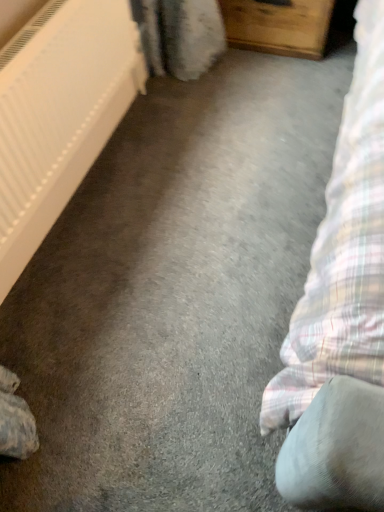
Question: Can you confirm if wooden chest of drawers at upper center is wider than white plastic radiator at left?

Choices:
 (A) yes
 (B) no

Answer: (A)

Question: Does wooden chest of drawers at upper center lie in front of white plastic radiator at left?

Choices:
 (A) no
 (B) yes

Answer: (A)

Question: Is wooden chest of drawers at upper center not within white plastic radiator at left?

Choices:
 (A) yes
 (B) no

Answer: (A)

Question: Does wooden chest of drawers at upper center contain white plastic radiator at left?

Choices:
 (A) yes
 (B) no

Answer: (B)

Question: Can you confirm if wooden chest of drawers at upper center is shorter than white plastic radiator at left?

Choices:
 (A) no
 (B) yes

Answer: (B)

Question: From a real-world perspective, does wooden chest of drawers at upper center stand above white plastic radiator at left?

Choices:
 (A) no
 (B) yes

Answer: (A)

Question: Is white plastic radiator at left to the left of wooden chest of drawers at upper center from the viewer's perspective?

Choices:
 (A) no
 (B) yes

Answer: (B)

Question: Are white plastic radiator at left and wooden chest of drawers at upper center making contact?

Choices:
 (A) no
 (B) yes

Answer: (A)

Question: Can you confirm if white plastic radiator at left is shorter than wooden chest of drawers at upper center?

Choices:
 (A) no
 (B) yes

Answer: (A)

Question: From a real-world perspective, is white plastic radiator at left physically above wooden chest of drawers at upper center?

Choices:
 (A) no
 (B) yes

Answer: (B)

Question: Can you confirm if white plastic radiator at left is wider than wooden chest of drawers at upper center?

Choices:
 (A) no
 (B) yes

Answer: (A)

Question: Does white plastic radiator at left come in front of wooden chest of drawers at upper center?

Choices:
 (A) no
 (B) yes

Answer: (B)

Question: Considering the positions of wooden chest of drawers at upper center and white plastic radiator at left in the image, is wooden chest of drawers at upper center taller or shorter than white plastic radiator at left?

Choices:
 (A) tall
 (B) short

Answer: (B)